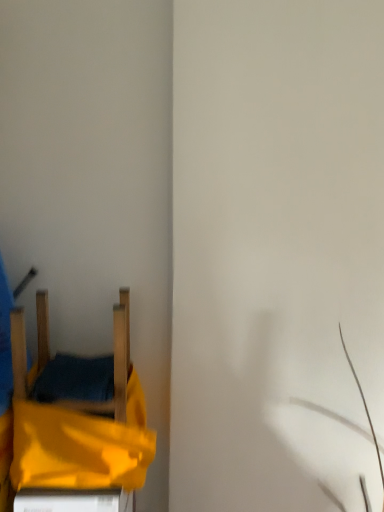
Question: From the image's perspective, is wooden chair at left positioned above or below yellow fabric bed at lower left?

Choices:
 (A) above
 (B) below

Answer: (A)

Question: In the image, is wooden chair at left on the left side or the right side of yellow fabric bed at lower left?

Choices:
 (A) left
 (B) right

Answer: (A)

Question: In terms of height, does wooden chair at left look taller or shorter compared to yellow fabric bed at lower left?

Choices:
 (A) short
 (B) tall

Answer: (B)

Question: Is yellow fabric bed at lower left to the left or to the right of wooden chair at left in the image?

Choices:
 (A) right
 (B) left

Answer: (A)

Question: Is yellow fabric bed at lower left spatially inside wooden chair at left, or outside of it?

Choices:
 (A) outside
 (B) inside

Answer: (A)

Question: Looking at the image, does yellow fabric bed at lower left seem bigger or smaller compared to wooden chair at left?

Choices:
 (A) small
 (B) big

Answer: (B)

Question: Is point (100, 381) closer or farther from the camera than point (46, 326)?

Choices:
 (A) farther
 (B) closer

Answer: (B)